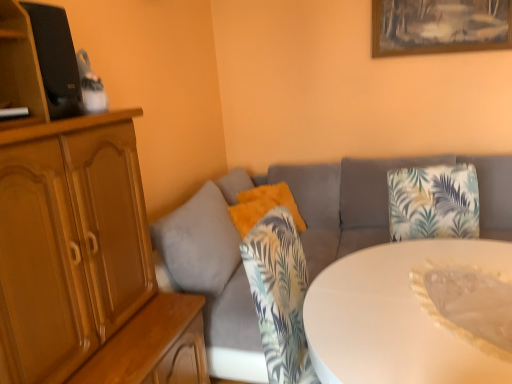
The width and height of the screenshot is (512, 384). What do you see at coordinates (303, 238) in the screenshot? I see `gray fabric couch at center` at bounding box center [303, 238].

In order to face wooden cabinet at upper left, should I rotate leftwards or rightwards?

A 27.690 degree turn to the left will do.

At what (x,y) coordinates should I click in order to perform the action: click on wooden cabinet at upper left. Please return your answer as a coordinate pair (x, y). Looking at the image, I should click on (20, 66).

This screenshot has width=512, height=384. Identify the location of white glossy table at center. (396, 317).

From the image's perspective, is gray fabric couch at center positioned above or below fuzzy orange pillow at center?

Based on their image positions, gray fabric couch at center is located beneath fuzzy orange pillow at center.

From a real-world perspective, does gray fabric couch at center stand above fuzzy orange pillow at center?

No, from a real-world perspective, gray fabric couch at center is not on top of fuzzy orange pillow at center.

Is gray fabric couch at center wider than fuzzy orange pillow at center?

Correct, the width of gray fabric couch at center exceeds that of fuzzy orange pillow at center.

Is gray fabric couch at center positioned with its back to fuzzy orange pillow at center?

Yes, gray fabric couch at center's orientation is away from fuzzy orange pillow at center.

Is wooden picture frame at upper center taller than wooden cabinet at upper left?

Correct, wooden picture frame at upper center is much taller as wooden cabinet at upper left.

How many degrees apart are the facing directions of wooden picture frame at upper center and wooden cabinet at upper left?

The angle between the facing direction of wooden picture frame at upper center and the facing direction of wooden cabinet at upper left is 90.8 degrees.

You are a GUI agent. You are given a task and a screenshot of the screen. Output one action in this format:
    pyautogui.click(x=<x>, y=<y>)
    Task: Click on the shelf on the left of wooden picture frame at upper center
    This screenshot has width=512, height=384.
    Given the screenshot: What is the action you would take?
    pyautogui.click(x=20, y=66)

Is wooden picture frame at upper center closer to the viewer compared to wooden cabinet at upper left?

No.

Is white glossy table at center located outside gray fabric couch at center?

A: Yes, white glossy table at center is located beyond the bounds of gray fabric couch at center.

Are white glossy table at center and gray fabric couch at center far apart?

Yes, white glossy table at center and gray fabric couch at center are located far from each other.

In the image, there is a white glossy table at center. Identify the location of studio couch above it (from the image's perspective). The width and height of the screenshot is (512, 384). (303, 238).

In the image, is wooden picture frame at upper center positioned in front of or behind white glossy table at center?

wooden picture frame at upper center is positioned farther from the viewer than white glossy table at center.

Does wooden picture frame at upper center turn towards white glossy table at center?

No, wooden picture frame at upper center is not aimed at white glossy table at center.

Can we say wooden picture frame at upper center lies outside white glossy table at center?

Yes.

From a real-world perspective, is gray fabric couch at center above or below white glossy table at center?

gray fabric couch at center is above white glossy table at center.

Is gray fabric couch at center positioned before white glossy table at center?

No.

Locate an element on the screen. This screenshot has height=384, width=512. studio couch behind the white glossy table at center is located at coordinates (303, 238).

Consider the image. Can you tell me how much gray fabric couch at center and white glossy table at center differ in facing direction?

The facing directions of gray fabric couch at center and white glossy table at center are 0.000396 degrees apart.

Could fuzzy orange pillow at center be considered to be inside white glossy table at center?

No, white glossy table at center does not contain fuzzy orange pillow at center.

Is white glossy table at center next to fuzzy orange pillow at center?

No, white glossy table at center is not with fuzzy orange pillow at center.

Which of these two, white glossy table at center or fuzzy orange pillow at center, stands shorter?

Standing shorter between the two is fuzzy orange pillow at center.

In the scene shown: Which point is more distant from viewer, (432, 329) or (259, 196)?

The point (259, 196) is farther.

How much distance is there between fuzzy orange pillow at center and white glossy table at center?

fuzzy orange pillow at center is 3.83 feet from white glossy table at center.

Which of these two, fuzzy orange pillow at center or white glossy table at center, is wider?

Wider between the two is white glossy table at center.

Between fuzzy orange pillow at center and white glossy table at center, which one is positioned in front?

white glossy table at center is more forward.

The width and height of the screenshot is (512, 384). I want to click on table below the fuzzy orange pillow at center (from a real-world perspective), so click(396, 317).

The height and width of the screenshot is (384, 512). I want to click on pillow on the left of gray fabric couch at center, so click(x=263, y=206).

Identify the location of shelf below the wooden picture frame at upper center (from a real-world perspective). The image size is (512, 384). (20, 66).

When comparing their distances from wooden picture frame at upper center, does gray fabric couch at center or wooden cabinet at upper left seem closer?

Based on the image, gray fabric couch at center appears to be nearer to wooden picture frame at upper center.

Looking at the image, which one is located closer to gray fabric couch at center, wooden picture frame at upper center or fuzzy orange pillow at center?

fuzzy orange pillow at center is positioned closer to the anchor gray fabric couch at center.

Looking at the image, which one is located further to wooden cabinet at upper left, white glossy table at center or wooden picture frame at upper center?

wooden picture frame at upper center is positioned further to the anchor wooden cabinet at upper left.

From the image, which object appears to be nearer to gray fabric couch at center, fuzzy orange pillow at center or white glossy table at center?

fuzzy orange pillow at center is closer to gray fabric couch at center.

Estimate the real-world distances between objects in this image. Which object is further from wooden picture frame at upper center, white glossy table at center or fuzzy orange pillow at center?

white glossy table at center lies further to wooden picture frame at upper center than the other object.

Estimate the real-world distances between objects in this image. Which object is closer to wooden cabinet at upper left, fuzzy orange pillow at center or gray fabric couch at center?

fuzzy orange pillow at center.

Which object lies further to the anchor point gray fabric couch at center, wooden picture frame at upper center or wooden cabinet at upper left?

wooden cabinet at upper left is positioned further to the anchor gray fabric couch at center.

From the image, which object appears to be nearer to wooden cabinet at upper left, fuzzy orange pillow at center or white glossy table at center?

white glossy table at center is positioned closer to the anchor wooden cabinet at upper left.

At what (x,y) coordinates should I click in order to perform the action: click on table between wooden cabinet at upper left and gray fabric couch at center in the horizontal direction. Please return your answer as a coordinate pair (x, y). The width and height of the screenshot is (512, 384). Looking at the image, I should click on (396, 317).

This screenshot has width=512, height=384. In order to click on table situated between wooden cabinet at upper left and wooden picture frame at upper center from left to right in this screenshot , I will do `click(396, 317)`.

Locate an element on the screen. This screenshot has height=384, width=512. studio couch positioned between white glossy table at center and fuzzy orange pillow at center from near to far is located at coordinates (303, 238).

Identify the location of studio couch situated between wooden cabinet at upper left and wooden picture frame at upper center from left to right. This screenshot has width=512, height=384. (303, 238).